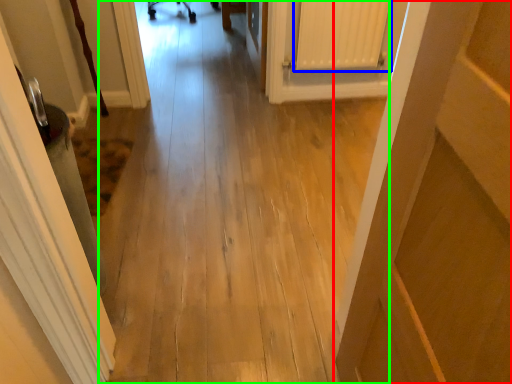
Question: Which object is positioned closest to door (highlighted by a red box)? Select from radiator (highlighted by a blue box) and path (highlighted by a green box).

Choices:
 (A) radiator
 (B) path

Answer: (B)